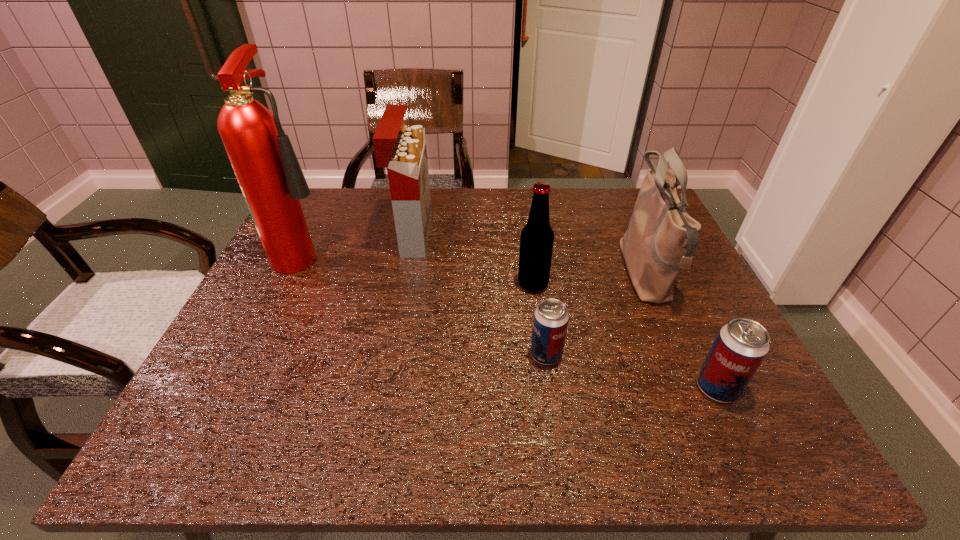
Where is `free area in between the fifth object from right to left and the leftmost object`? The image size is (960, 540). free area in between the fifth object from right to left and the leftmost object is located at coordinates (360, 244).

This screenshot has width=960, height=540. I want to click on free area in between the shoulder bag and the farther beer can, so click(596, 314).

This screenshot has height=540, width=960. In order to click on vacant region between the shoulder bag and the taller beer can in this screenshot , I will do `click(682, 331)`.

At what (x,y) coordinates should I click in order to perform the action: click on free space between the beer bottle and the second object from left to right. Please return your answer as a coordinate pair (x, y). Looking at the image, I should click on (473, 260).

Find the location of `unoccupied position between the fire extinguisher and the cigarette case`. unoccupied position between the fire extinguisher and the cigarette case is located at coordinates (360, 244).

At what (x,y) coordinates should I click in order to perform the action: click on vacant space that's between the fourth tallest object and the fire extinguisher. Please return your answer as a coordinate pair (x, y). This screenshot has height=540, width=960. Looking at the image, I should click on (420, 268).

You are a GUI agent. You are given a task and a screenshot of the screen. Output one action in this format:
    pyautogui.click(x=<x>, y=<y>)
    Task: Click on the free space between the nearest object and the leftmost object
    Image resolution: width=960 pixels, height=540 pixels.
    Given the screenshot: What is the action you would take?
    pyautogui.click(x=512, y=320)

This screenshot has height=540, width=960. What are the coordinates of `object that is the fourth closest to the shoulder bag` in the screenshot? It's located at (401, 149).

Locate an element on the screen. Image resolution: width=960 pixels, height=540 pixels. object that is the third closest one to the shoulder bag is located at coordinates (551, 318).

What are the coordinates of `free point that satisfies the following two spatial constraints: 1. with the lid open on the cigarette case; 2. on the left side of the beer bottle` in the screenshot? It's located at (403, 285).